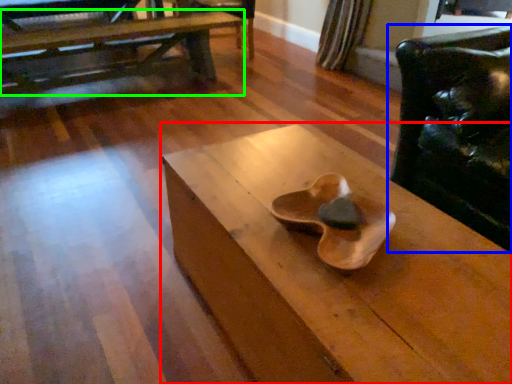
Question: Which object is positioned farthest from table (highlighted by a red box)? Select from chair (highlighted by a blue box) and table (highlighted by a green box).

Choices:
 (A) chair
 (B) table

Answer: (B)